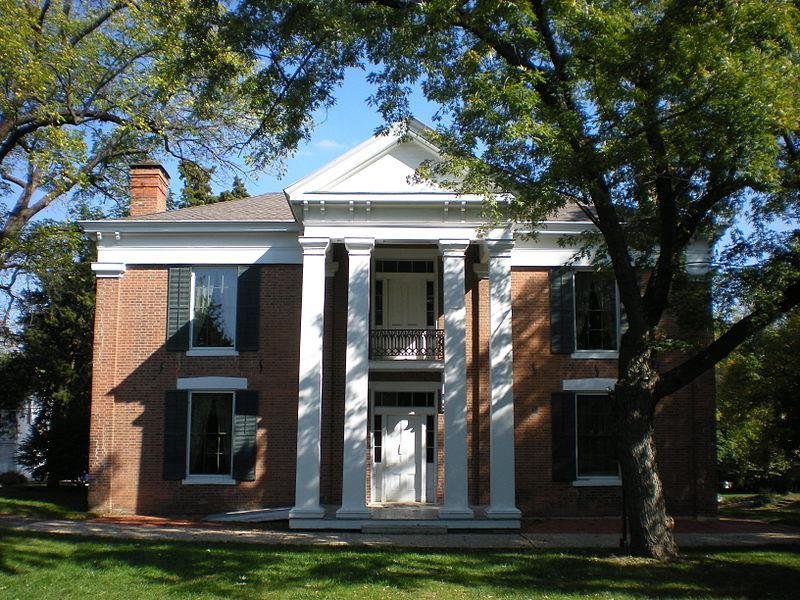
Where is `window`? window is located at coordinates (213, 295).